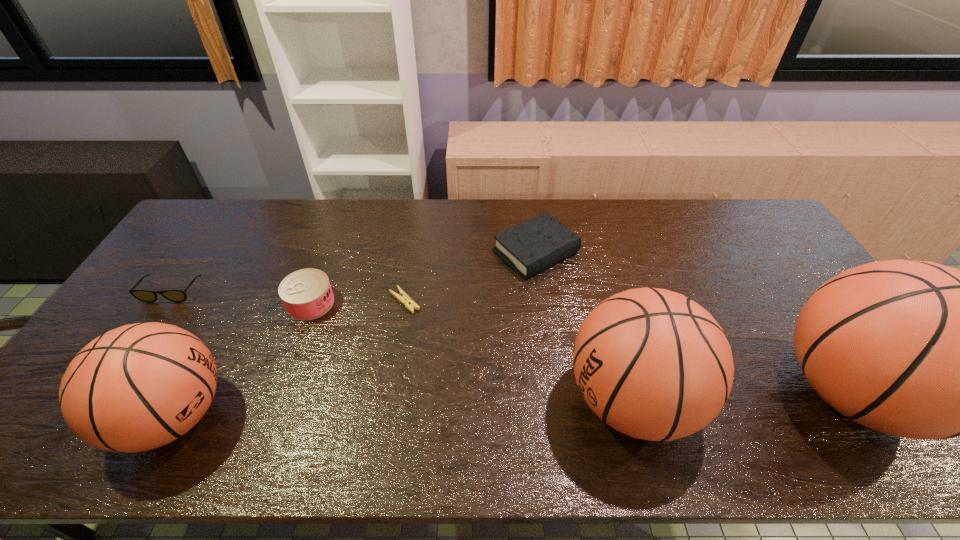
I want to click on the leftmost basketball, so click(x=138, y=387).

You are a GUI agent. You are given a task and a screenshot of the screen. Output one action in this format:
    pyautogui.click(x=<x>, y=<y>)
    Task: Click on the third tallest object
    
    Given the screenshot: What is the action you would take?
    pyautogui.click(x=138, y=387)

The image size is (960, 540). I want to click on the second basketball from left to right, so click(x=651, y=363).

Where is `the second tallest basketball`? The image size is (960, 540). the second tallest basketball is located at coordinates (651, 363).

The height and width of the screenshot is (540, 960). I want to click on the fifth tallest object, so click(x=534, y=245).

The width and height of the screenshot is (960, 540). What are the coordinates of `the fourth tallest object` in the screenshot? It's located at (306, 294).

Find the location of a particular element. This screenshot has width=960, height=540. the fifth object from right to left is located at coordinates (306, 294).

This screenshot has width=960, height=540. What are the coordinates of `the shortest object` in the screenshot? It's located at (402, 297).

Locate an element on the screen. This screenshot has width=960, height=540. the fourth object from right to left is located at coordinates (402, 297).

Where is `sunglasses`? sunglasses is located at coordinates (173, 295).